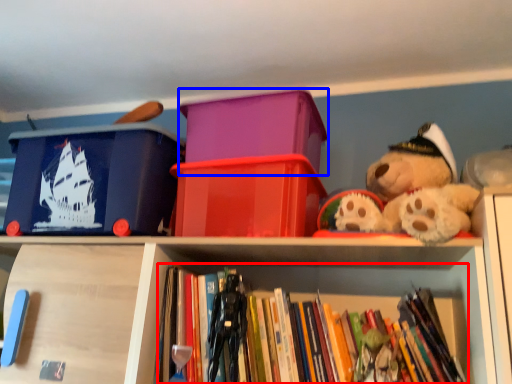
Question: Which object is further to the camera taking this photo, book (highlighted by a red box) or storage box (highlighted by a blue box)?

Choices:
 (A) book
 (B) storage box

Answer: (B)